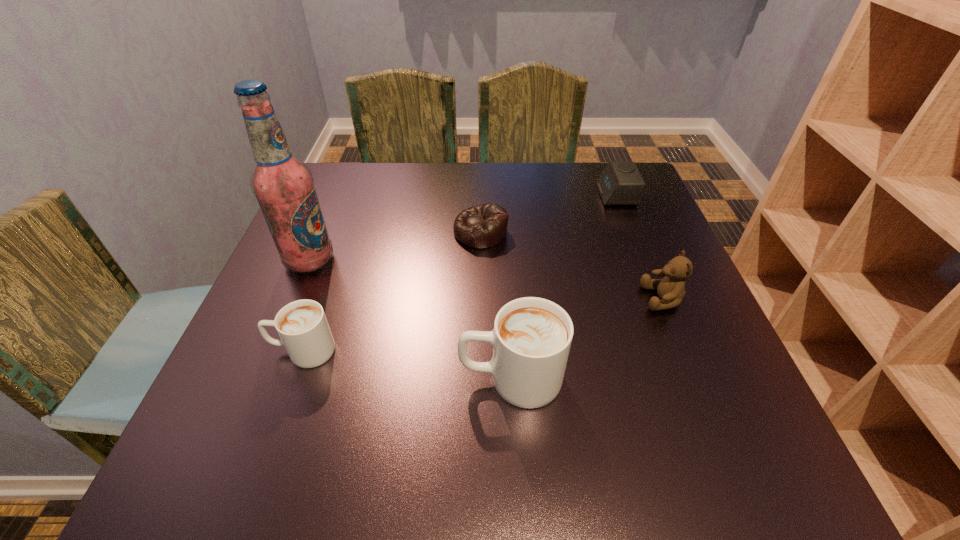
Find the location of a particular element. vacant region located on the side with the handle of the taller cappuccino is located at coordinates pos(431,378).

This screenshot has height=540, width=960. Find the location of `free region located 0.140m on the side with the handle of the taller cappuccino`. free region located 0.140m on the side with the handle of the taller cappuccino is located at coordinates pos(380,378).

The image size is (960, 540). Find the location of `free space located 0.390m on the side with the handle of the taller cappuccino`. free space located 0.390m on the side with the handle of the taller cappuccino is located at coordinates (237, 378).

Where is `vacant space located 0.240m on the front-facing side of the fifth tallest object`? The height and width of the screenshot is (540, 960). vacant space located 0.240m on the front-facing side of the fifth tallest object is located at coordinates (511, 195).

What are the coordinates of `free space located on the front-facing side of the fifth tallest object` in the screenshot? It's located at (547, 195).

Identify the location of blank space located 0.370m on the front-facing side of the fifth tallest object. This screenshot has height=540, width=960. (462, 195).

The image size is (960, 540). I want to click on free space located 0.350m on the right of the tallest object, so click(490, 260).

Locate an element on the screen. vacant area situated on the back of the shortest object is located at coordinates (481, 204).

Find the location of `vacant position located on the front-facing side of the fourth farthest object`. vacant position located on the front-facing side of the fourth farthest object is located at coordinates tap(594, 299).

In order to click on vacant region located on the front-facing side of the fourth farthest object in this screenshot , I will do `click(565, 299)`.